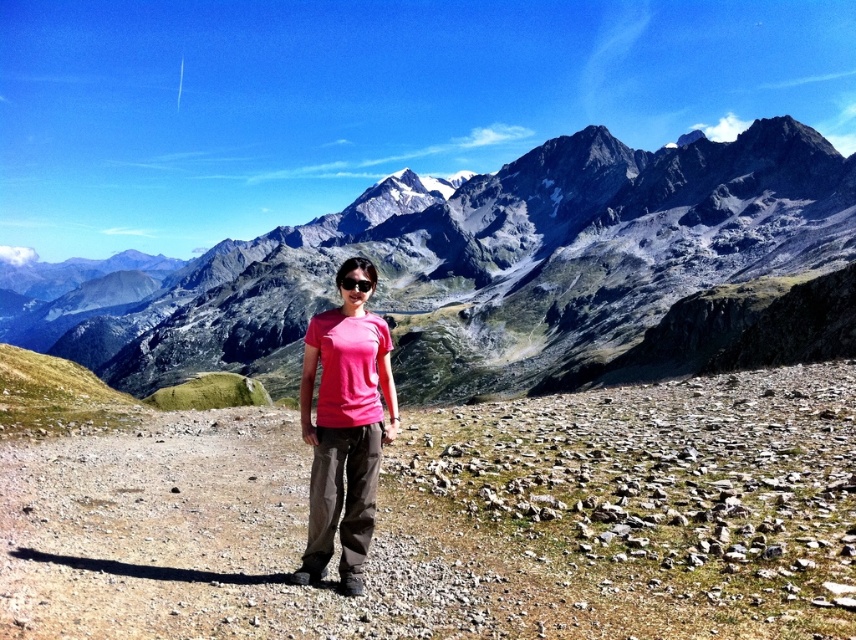
You are a photographer trying to capture the person in the pink fabric shirt at center. Given the coordinates of the pink fabric shirt at center as point (343, 433), where should you focus your camera to ensure the person is in sharp focus?

The camera should focus on point (343, 433) where the pink fabric shirt at center is located to ensure the person is in sharp focus.

You are a photographer standing at the base of the rocky gray mountain range at center. You want to take a photo of the mountain range from a distance of 300 feet. Can you do it without moving your position?

The rocky gray mountain range at center and camera are 331.09 feet apart, so you cannot take the photo from 300 feet away without moving closer because the current distance is 331.09 feet.

You are planning a hiking route and need to decide between two landmarks visible from your current position. The landmarks are the rocky gray mountain range at center and the green grassy hillside at left. Based on their sizes, which one is more likely to be farther away?

The rocky gray mountain range at center is larger in size compared to the green grassy hillside at left, so it is more likely to be closer rather than farther away. Therefore, the green grassy hillside at left is farther away.